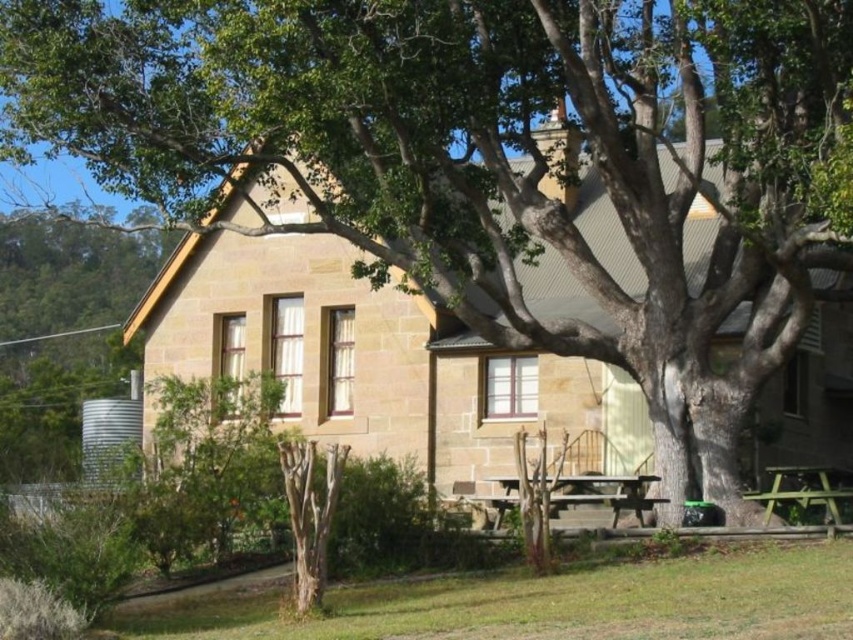
Measure the distance between wooden picnic table at center and camera.

The distance of wooden picnic table at center from camera is 27.98 meters.

Where is `wooden picnic table at center`? The width and height of the screenshot is (853, 640). wooden picnic table at center is located at coordinates (604, 493).